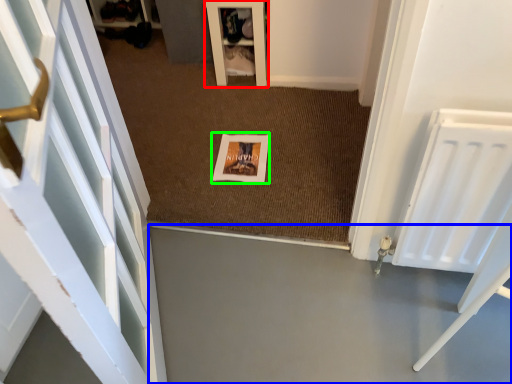
Question: Considering the real-world distances, which object is farthest from furniture (highlighted by a red box)? concrete (highlighted by a blue box) or picture frame (highlighted by a green box)?

Choices:
 (A) concrete
 (B) picture frame

Answer: (A)